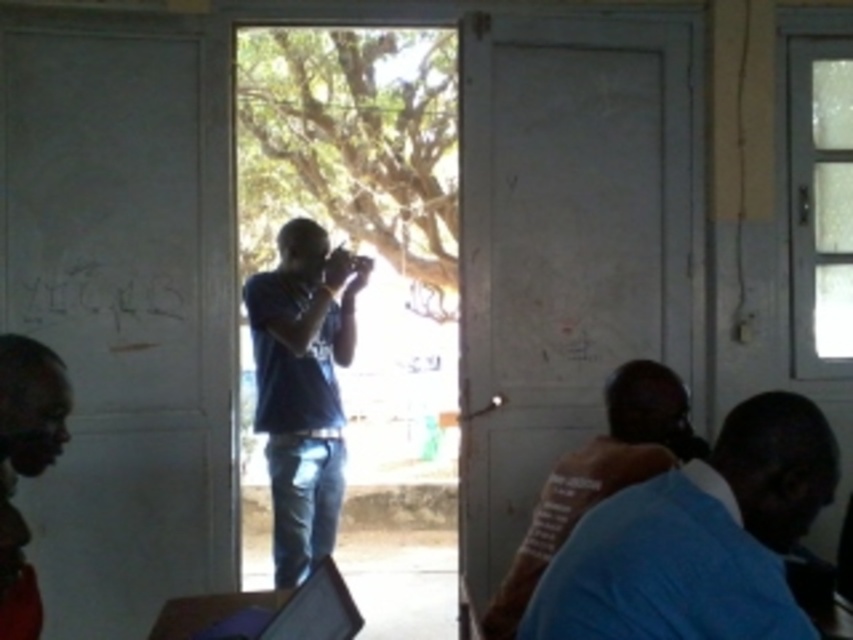
You are organizing a photo shoot and need to place a 20 cm wide prop between the blue denim jeans at center and the matte black laptop at lower left. Based on their widths, will there be enough space for the prop?

The blue denim jeans at center has a width less than the matte black laptop at lower left. Since the prop is 20 cm wide, but the exact widths of the objects aren not provided, it is uncertain if there is sufficient space between them to place the prop.

You are a photographer standing in the room and want to take a clear photo of the dark red shirt at lower left. Can you reach it with your camera if your camera has a maximum focus range of 1.8 meters?

The dark red shirt at lower left is 1.77 meters away from the viewer, which is within the camera maximum focus range of 1.8 meters. So yes, the photographer can take a clear photo of the dark red shirt at lower left.